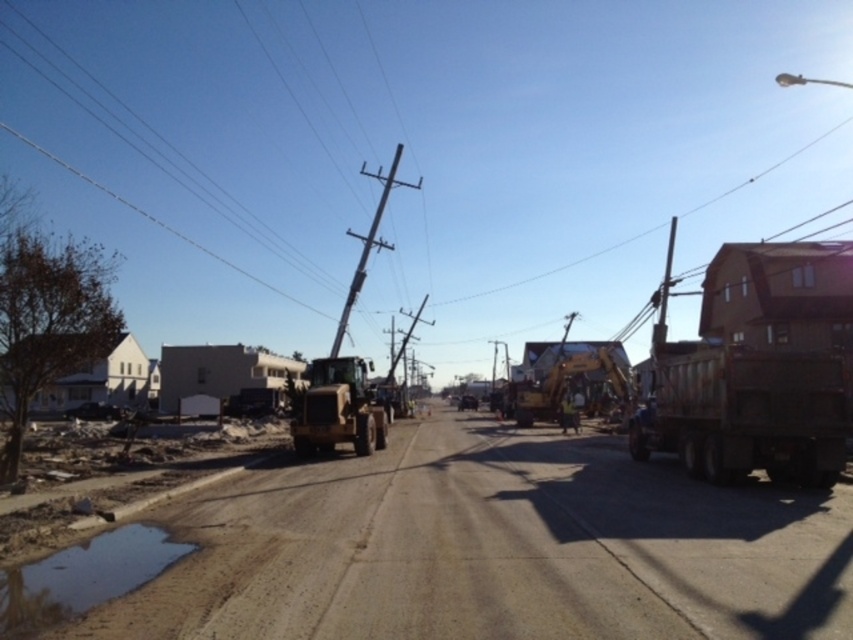
Can you confirm if dirt track at center is taller than gold metallic excavator at center?

Incorrect, dirt track at center's height is not larger of gold metallic excavator at center's.

Does dirt track at center have a greater width compared to gold metallic excavator at center?

Correct, the width of dirt track at center exceeds that of gold metallic excavator at center.

Between point (149, 582) and point (358, 452), which one is positioned behind?

Point (358, 452)

Find the location of a particular element. The width and height of the screenshot is (853, 640). dirt track at center is located at coordinates (492, 548).

Can you confirm if brown muddy puddle at lower left is positioned to the left of gold metallic excavator at center?

No, brown muddy puddle at lower left is not to the left of gold metallic excavator at center.

Who is more forward, (62, 573) or (367, 394)?

A: Point (62, 573)

Locate an element on the screen. brown muddy puddle at lower left is located at coordinates (82, 577).

Measure the distance between rusty metal truck at right and gold metallic excavator at center.

rusty metal truck at right is 13.92 meters away from gold metallic excavator at center.

At what (x,y) coordinates should I click in order to perform the action: click on rusty metal truck at right. Please return your answer as a coordinate pair (x, y). This screenshot has width=853, height=640. Looking at the image, I should click on (744, 412).